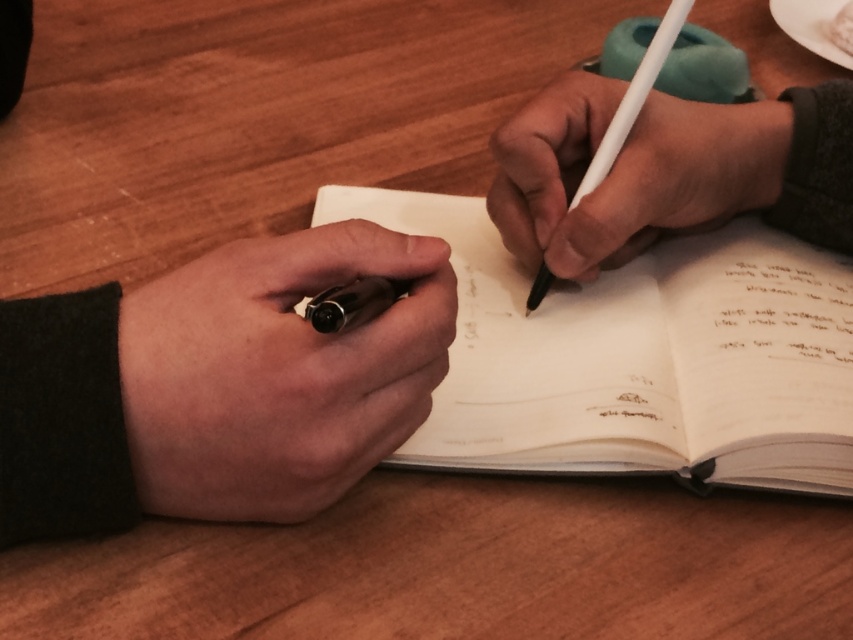
Who is higher up, black ink handwriting at upper right or white matte pencil at center?

white matte pencil at center is higher up.

Does black ink handwriting at upper right have a lesser width compared to white matte pencil at center?

Yes.

Measure the distance between point (715, 301) and camera.

Point (715, 301) is 16.50 inches away from camera.

Locate an element on the screen. black ink handwriting at upper right is located at coordinates (784, 307).

Between white matte pen at center and matte black pen at center, which one appears on the left side from the viewer's perspective?

matte black pen at center is more to the left.

Can you confirm if white matte pen at center is wider than matte black pen at center?

Yes, white matte pen at center is wider than matte black pen at center.

Between point (601, 202) and point (308, 307), which one is positioned in front?

Positioned in front is point (308, 307).

Where is `white matte pen at center`? The height and width of the screenshot is (640, 853). white matte pen at center is located at coordinates (627, 172).

Is point (247, 312) in front of point (799, 305)?

Yes, point (247, 312) is in front of point (799, 305).

Which is behind, point (178, 346) or point (836, 301)?

Point (836, 301)

Find the location of a particular element. matte black pen at left is located at coordinates (277, 372).